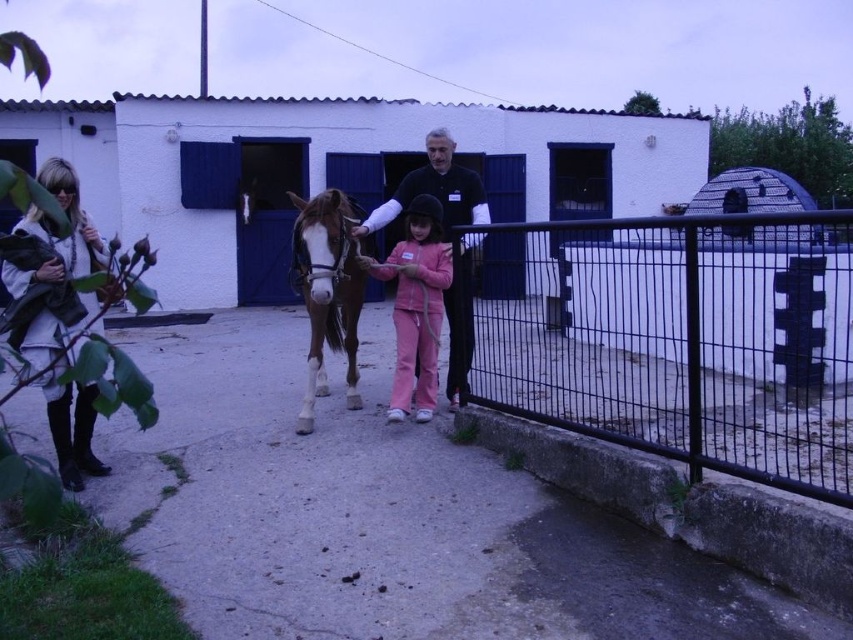
You are standing in the stable and see the brown glossy horse at center and the black matte shirt at center. Which object is positioned to the right?

The black matte shirt at center is positioned to the right of the brown glossy horse at center.

You are the trainer in the image and you need to retrieve your coat. Where is the white textured coat at left located in the image?

The white textured coat at left is located at point (62, 396) in the image.

You are a photographer setting up for an outdoor photoshoot at the stable. You need to place a backdrop that must be wider than both the white textured coat at left and the brown glossy horse at center. What is the minimum width your backdrop should have?

The white textured coat at left might be wider than brown glossy horse at center, so the backdrop should be wider than the white textured coat at left to ensure it covers both objects properly.